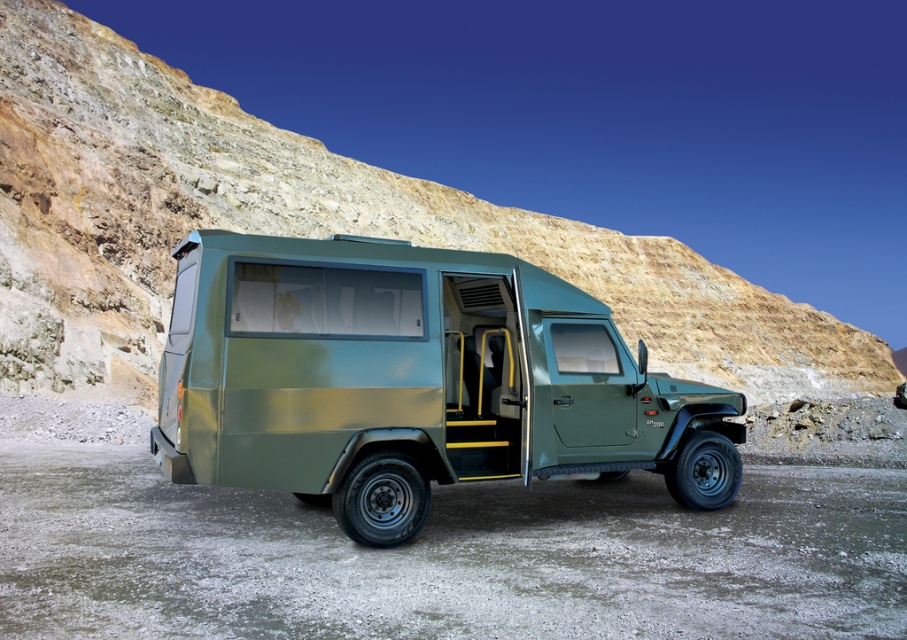
Question: Which point appears closest to the camera in this image?

Choices:
 (A) (18, 154)
 (B) (291, 401)

Answer: (B)

Question: Does matte green truck at center appear under green matte jeep at center?

Choices:
 (A) no
 (B) yes

Answer: (A)

Question: Does matte green truck at center appear under green matte jeep at center?

Choices:
 (A) no
 (B) yes

Answer: (A)

Question: Is matte green truck at center above green matte jeep at center?

Choices:
 (A) yes
 (B) no

Answer: (A)